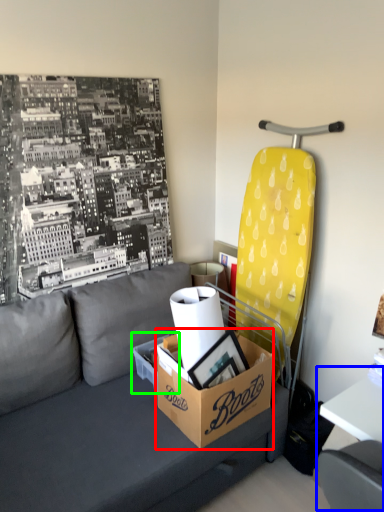
Question: Which is farther away from box (highlighted by a red box)? table (highlighted by a blue box) or cardboard box (highlighted by a green box)?

Choices:
 (A) table
 (B) cardboard box

Answer: (A)